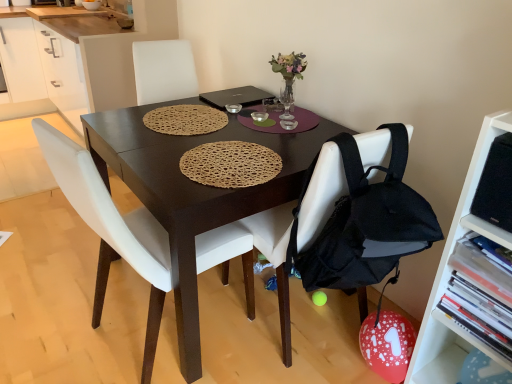
This screenshot has height=384, width=512. What are the coordinates of `free space in front of black matte laptop at center` in the screenshot? It's located at (215, 115).